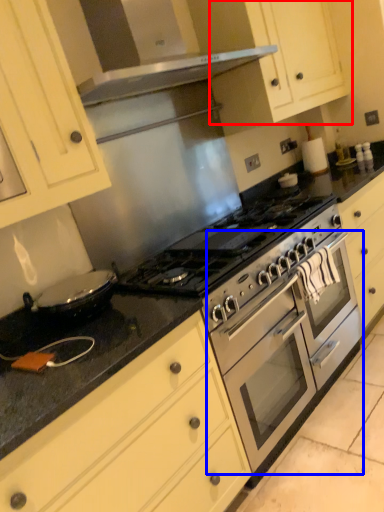
Question: Which object is closer to the camera taking this photo, cabinetry (highlighted by a red box) or oven (highlighted by a blue box)?

Choices:
 (A) cabinetry
 (B) oven

Answer: (B)